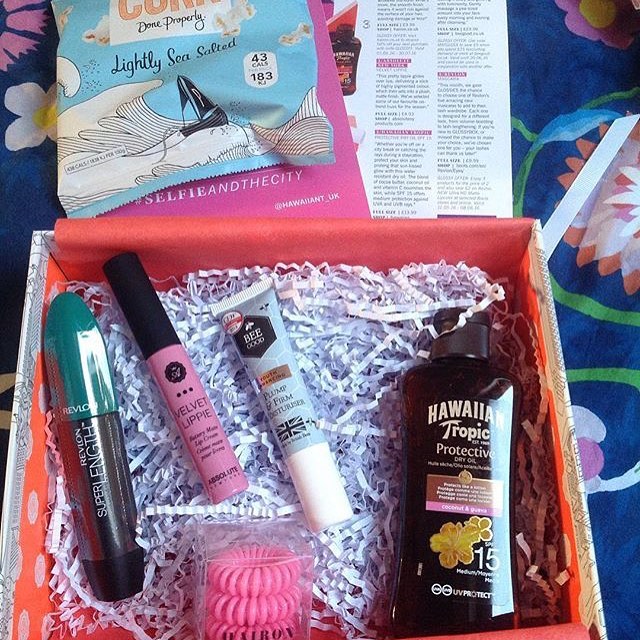
At what (x,y) coordinates should I click in order to perform the action: click on box. Please return your answer as a coordinate pair (x, y). Looking at the image, I should click on (557, 370), (19, 403).